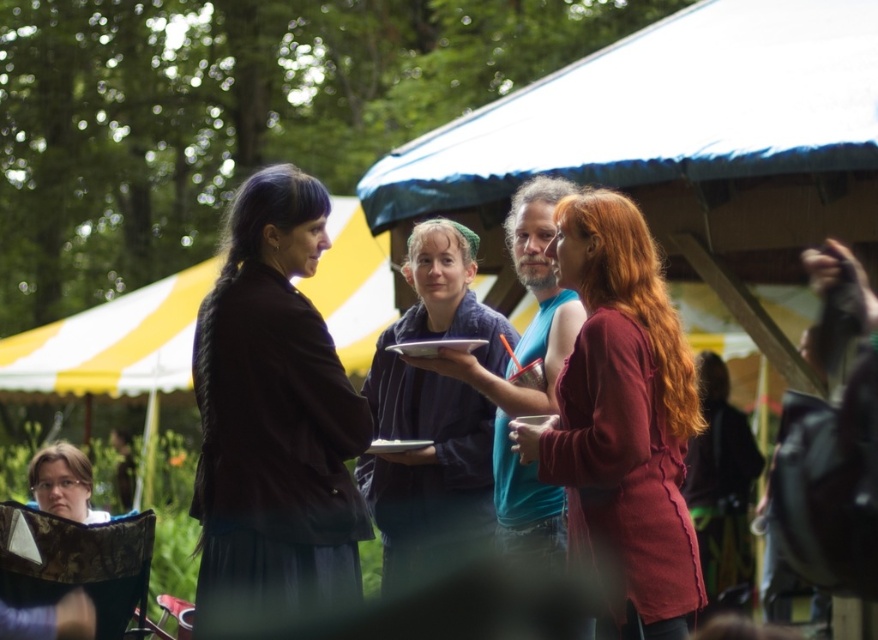
Question: Can you confirm if maroon knit sweater at center is bigger than matte black jacket at lower left?

Choices:
 (A) no
 (B) yes

Answer: (A)

Question: Which object appears farthest from the camera in this image?

Choices:
 (A) matte brown jacket at left
 (B) blue cotton tank top at center
 (C) dark blue fabric at center

Answer: (C)

Question: Does matte brown jacket at left have a greater width compared to maroon knit sweater at center?

Choices:
 (A) yes
 (B) no

Answer: (B)

Question: Where is matte brown jacket at left located in relation to dark blue fabric at center in the image?

Choices:
 (A) above
 (B) below

Answer: (A)

Question: Which point appears closest to the camera in this image?

Choices:
 (A) (42, 476)
 (B) (572, 502)

Answer: (B)

Question: Estimate the real-world distances between objects in this image. Which object is farther from the dark blue fabric at center?

Choices:
 (A) maroon knit sweater at center
 (B) matte black jacket at lower left
 (C) blue cotton tank top at center
 (D) matte brown jacket at left

Answer: (D)